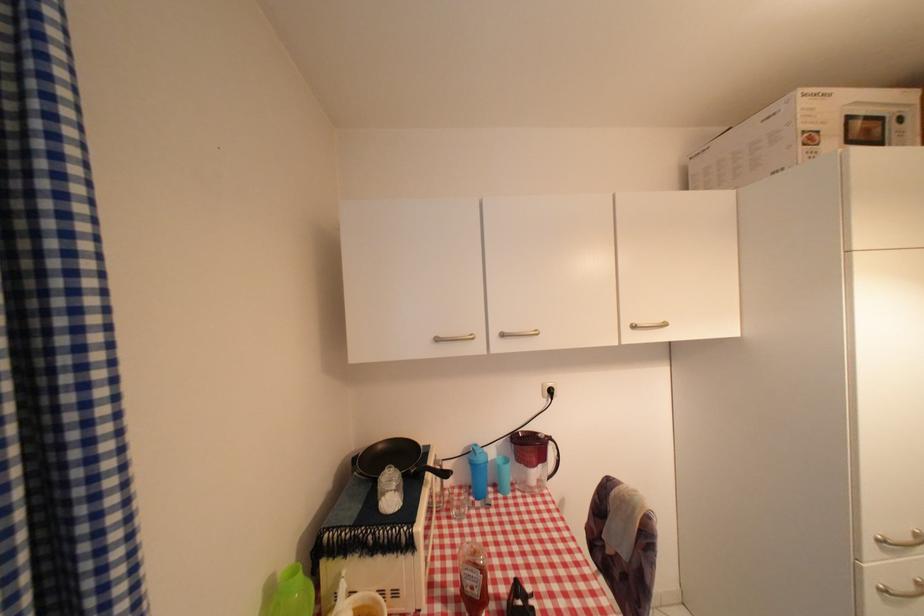
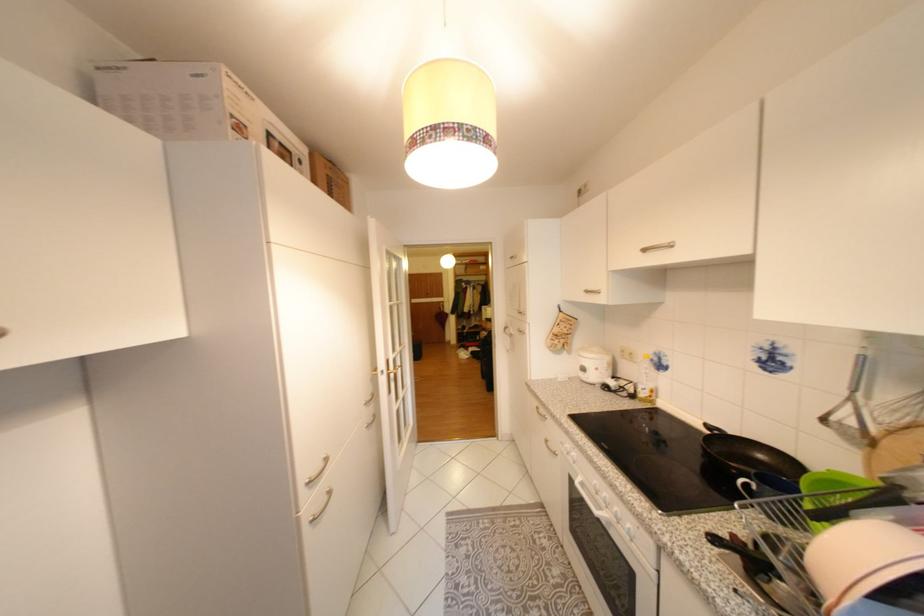
In the second image, find the point that corresponds to pixel 891 120 in the first image.

(299, 153)